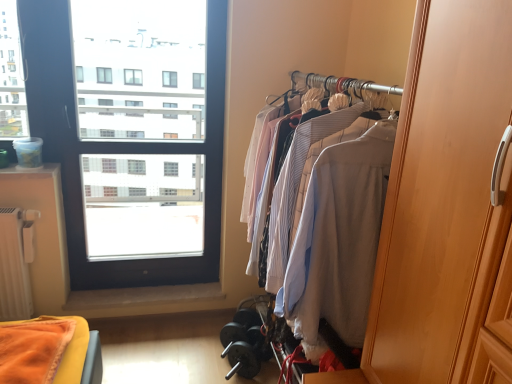
Question: Is transparent glass window at upper left shorter than light beige wood closet at right?

Choices:
 (A) no
 (B) yes

Answer: (A)

Question: Does transparent glass window at upper left have a smaller size compared to light beige wood closet at right?

Choices:
 (A) yes
 (B) no

Answer: (A)

Question: Does transparent glass window at upper left turn towards light beige wood closet at right?

Choices:
 (A) yes
 (B) no

Answer: (B)

Question: Is transparent glass window at upper left positioned in front of light beige wood closet at right?

Choices:
 (A) no
 (B) yes

Answer: (A)

Question: Would you say transparent glass window at upper left is outside light beige wood closet at right?

Choices:
 (A) yes
 (B) no

Answer: (A)

Question: From a real-world perspective, is wooden wardrobe at right positioned above or below transparent glass window at upper left?

Choices:
 (A) above
 (B) below

Answer: (A)

Question: In terms of width, does wooden wardrobe at right look wider or thinner when compared to transparent glass window at upper left?

Choices:
 (A) thin
 (B) wide

Answer: (B)

Question: Is point (452, 193) closer or farther from the camera than point (200, 193)?

Choices:
 (A) farther
 (B) closer

Answer: (B)

Question: Is wooden wardrobe at right situated inside transparent glass window at upper left or outside?

Choices:
 (A) outside
 (B) inside

Answer: (A)

Question: In terms of width, does transparent glass window at upper left look wider or thinner when compared to light beige wood closet at right?

Choices:
 (A) thin
 (B) wide

Answer: (A)

Question: Considering the relative positions of transparent glass window at upper left and light beige wood closet at right in the image provided, is transparent glass window at upper left to the left or to the right of light beige wood closet at right?

Choices:
 (A) left
 (B) right

Answer: (A)

Question: From their relative heights in the image, would you say transparent glass window at upper left is taller or shorter than light beige wood closet at right?

Choices:
 (A) short
 (B) tall

Answer: (B)

Question: In terms of size, does transparent glass window at upper left appear bigger or smaller than light beige wood closet at right?

Choices:
 (A) small
 (B) big

Answer: (A)

Question: Would you say wooden wardrobe at right is inside or outside light beige wood closet at right?

Choices:
 (A) outside
 (B) inside

Answer: (A)

Question: From the image's perspective, relative to light beige wood closet at right, is wooden wardrobe at right above or below?

Choices:
 (A) below
 (B) above

Answer: (B)